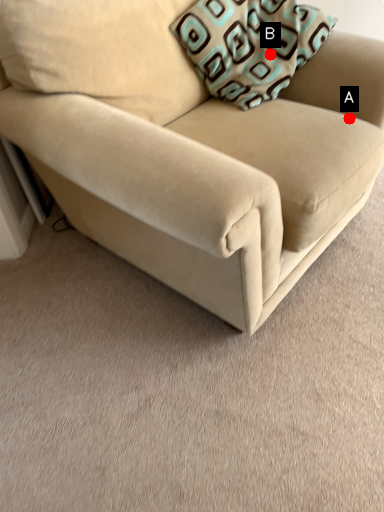
Question: Two points are circled on the image, labeled by A and B beside each circle. Which point is closer to the camera?

Choices:
 (A) A is closer
 (B) B is closer

Answer: (A)